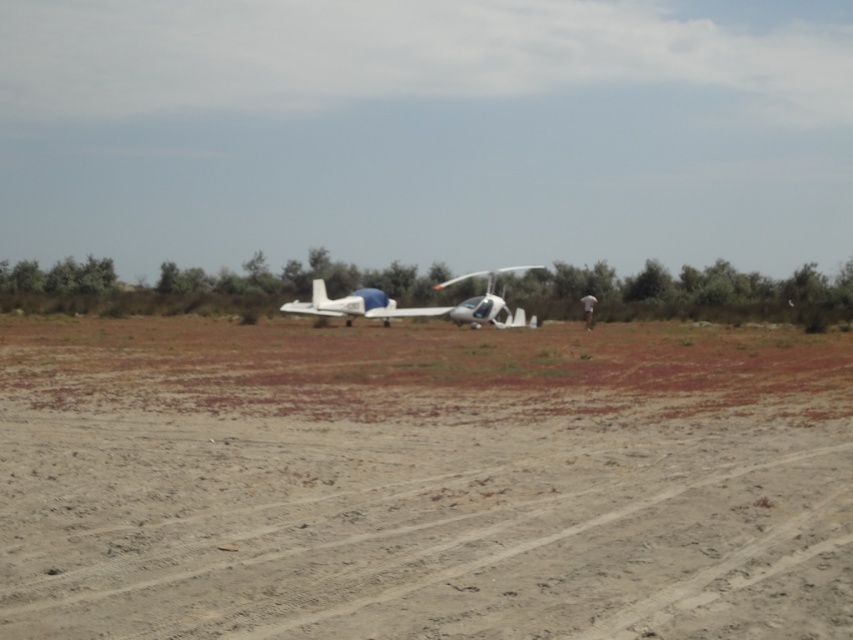
In the scene shown: You are a pilot trying to board your white matte airplane at center. There is a metallic silver helicopter at center blocking the entrance. Can you safely move the helicopter to the side to access your plane?

The white matte airplane at center and metallic silver helicopter at center are 5.98 meters apart. Since the distance between them is sufficient, you can safely move the helicopter to the side to access your plane.

You are a pilot trying to land a helicopter in the open terrain. You see the dirt at center and the metallic silver helicopter at center. Which object should you aim for to land safely?

You should aim for the dirt at center because it is below the metallic silver helicopter at center, indicating it is the landing surface.